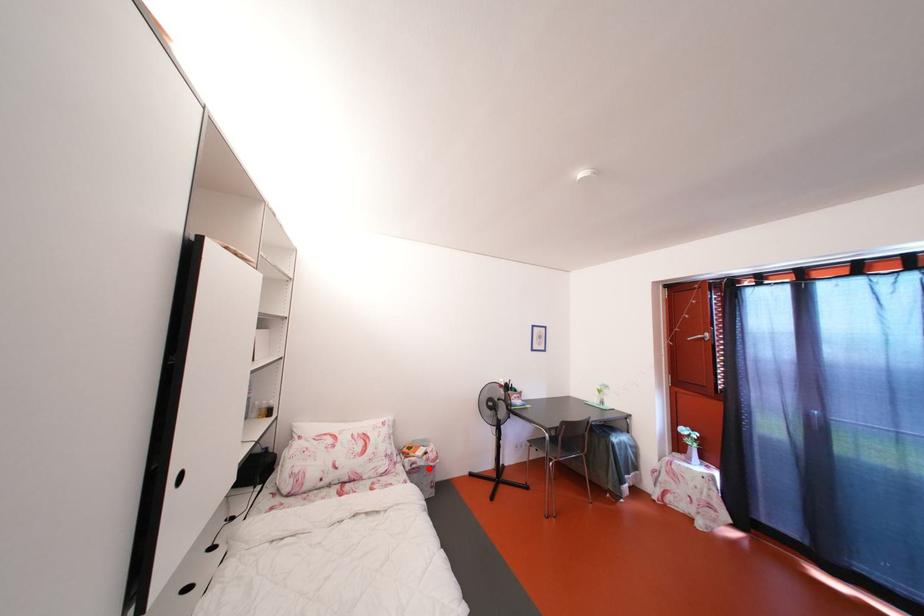
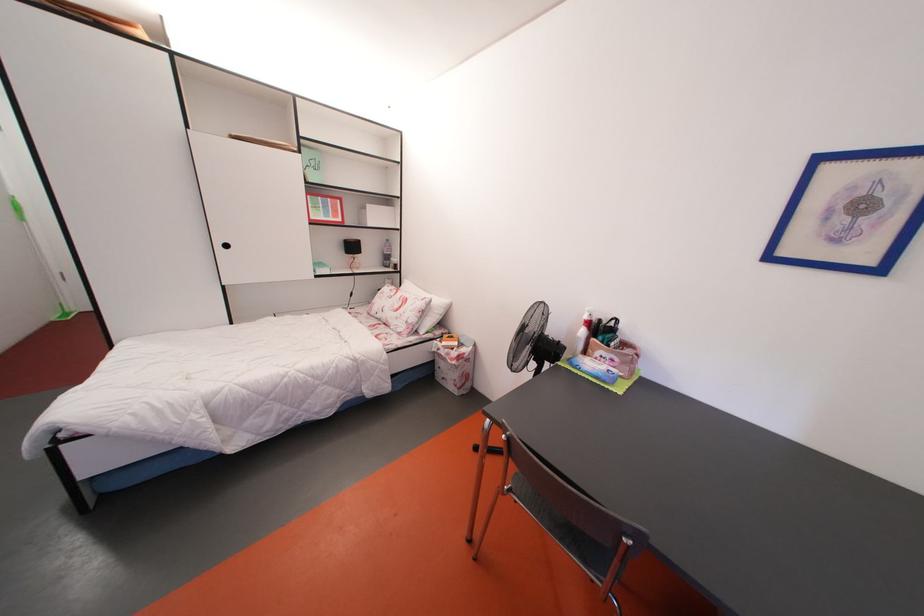
The point at the highlighted location is marked in the first image. Where is the corresponding point in the second image?

(450, 360)